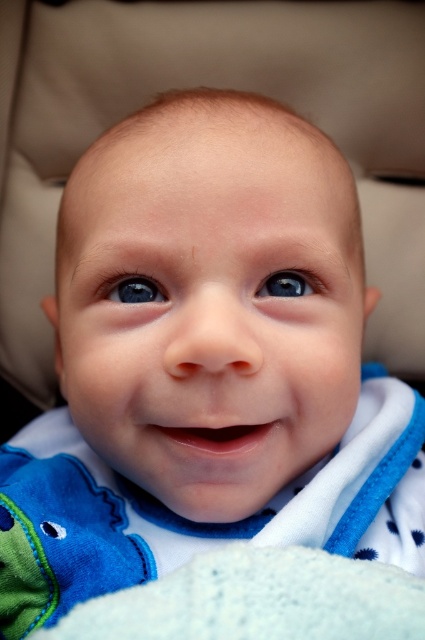
You are a photographer taking a close up shot of a baby. You notice the white soft blanket at lower center and the blue glossy eye at upper center in your viewfinder. Which object takes up more space in the photo?

The white soft blanket at lower center takes up more space in the photo because it is bigger than the blue glossy eye at upper center according to the description.

You are a photographer adjusting the focus on a camera. You notice two points in the image of a baby in a car seat. The first point is at coordinates point (73,636) and the second is at point (136,294). Which point should you focus on to ensure the baby is in sharp focus?

You should focus on point (73,636) because it is closer to the viewer than point (136,294), ensuring the baby is in sharp focus.

You are a parent holding a baby in a car seat. You want to place the blue fleece bib at center on the baby without disturbing them. The white soft blanket at lower center is nearby. Is there enough space between them to safely place the bib?

The distance between the blue fleece bib at center and the white soft blanket at lower center is 5.62 inches. Since the bib needs only minimal space to be placed, there is sufficient room to safely position it without disturbing the baby.